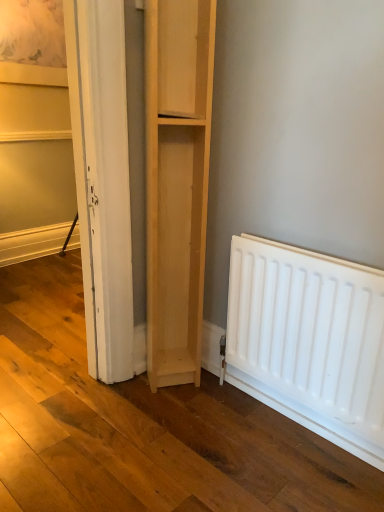
Locate an element on the screen. The image size is (384, 512). vacant area to the left of natural wood cupboard at center is located at coordinates pos(128,390).